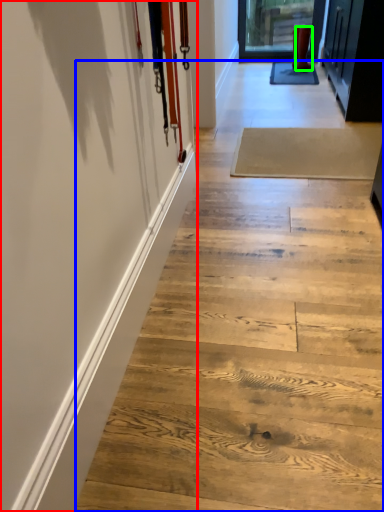
Question: Considering the real-world distances, which object is farthest from barn door (highlighted by a red box)? stair (highlighted by a blue box) or footwear (highlighted by a green box)?

Choices:
 (A) stair
 (B) footwear

Answer: (B)